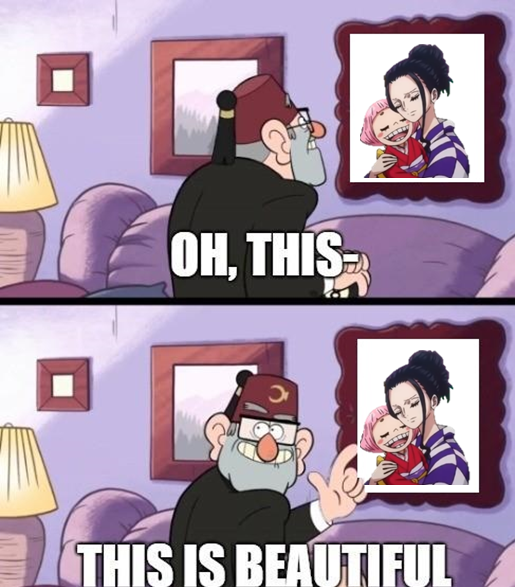
Where is `black picture frame`? Image resolution: width=515 pixels, height=587 pixels. black picture frame is located at coordinates (479, 326), (477, 195).